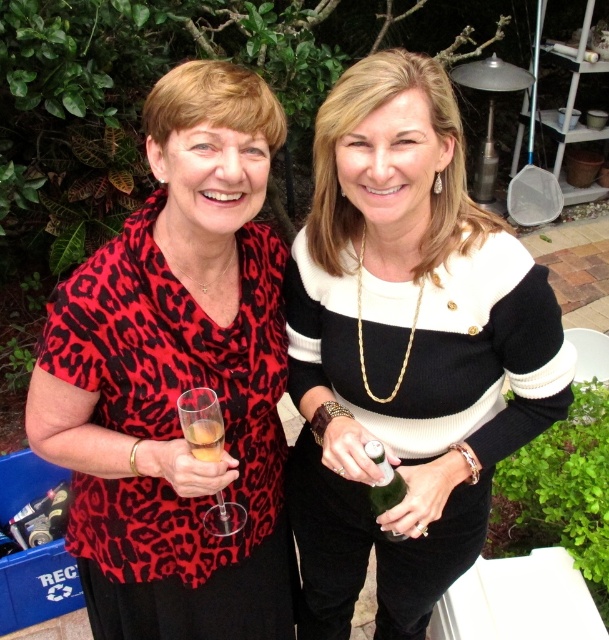
You are a photographer adjusting your camera to focus on the leopard print blouse at left and the green glass bottle at center. Which object should you focus on first if you want to capture both in sharp detail?

The leopard print blouse at left is above the green glass bottle at center, so you should focus on the leopard print blouse at left first to ensure both are in sharp detail.

Based on the scene description, which object is positioned lower in the image between the black and white sweater at center and the leopard print blouse at left?

The black and white sweater at center is positioned below the leopard print blouse at left, so it is lower in the image.